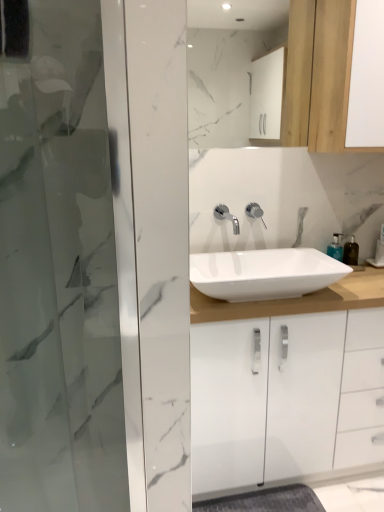
Question: Can translucent plastic soap dispenser at right, the first soap dispenser positioned from the left, be found inside white marble mirror at upper center?

Choices:
 (A) yes
 (B) no

Answer: (B)

Question: Can you confirm if white marble mirror at upper center is wider than translucent plastic soap dispenser at right, which is counted as the second soap dispenser, starting from the right?

Choices:
 (A) yes
 (B) no

Answer: (B)

Question: Does white marble mirror at upper center touch translucent plastic soap dispenser at right, the first soap dispenser positioned from the left?

Choices:
 (A) yes
 (B) no

Answer: (B)

Question: Is white marble mirror at upper center further to the viewer compared to translucent plastic soap dispenser at right, which is counted as the second soap dispenser, starting from the right?

Choices:
 (A) no
 (B) yes

Answer: (A)

Question: Is white marble mirror at upper center to the left of translucent plastic soap dispenser at right, which is counted as the second soap dispenser, starting from the right, from the viewer's perspective?

Choices:
 (A) yes
 (B) no

Answer: (A)

Question: Does white marble mirror at upper center have a lesser width compared to translucent plastic soap dispenser at right, which is counted as the second soap dispenser, starting from the right?

Choices:
 (A) yes
 (B) no

Answer: (A)

Question: Is wooden cabinet at upper right bigger than polished chrome faucet at center, which ranks as the second tap in right-to-left order?

Choices:
 (A) yes
 (B) no

Answer: (A)

Question: Considering the relative sizes of wooden cabinet at upper right and polished chrome faucet at center, which ranks as the second tap in right-to-left order, in the image provided, is wooden cabinet at upper right wider than polished chrome faucet at center, which ranks as the second tap in right-to-left order,?

Choices:
 (A) no
 (B) yes

Answer: (B)

Question: From the image's perspective, is wooden cabinet at upper right below polished chrome faucet at center, which ranks as the second tap in right-to-left order?

Choices:
 (A) no
 (B) yes

Answer: (A)

Question: Is wooden cabinet at upper right smaller than polished chrome faucet at center, which ranks as the second tap in right-to-left order?

Choices:
 (A) yes
 (B) no

Answer: (B)

Question: Is wooden cabinet at upper right not near polished chrome faucet at center, the first tap from the left?

Choices:
 (A) yes
 (B) no

Answer: (B)

Question: Are wooden cabinet at upper right and polished chrome faucet at center, which ranks as the second tap in right-to-left order, beside each other?

Choices:
 (A) yes
 (B) no

Answer: (B)

Question: Is white glossy sink at center oriented towards polished chrome faucet at center, which ranks as the second tap in right-to-left order?

Choices:
 (A) yes
 (B) no

Answer: (B)